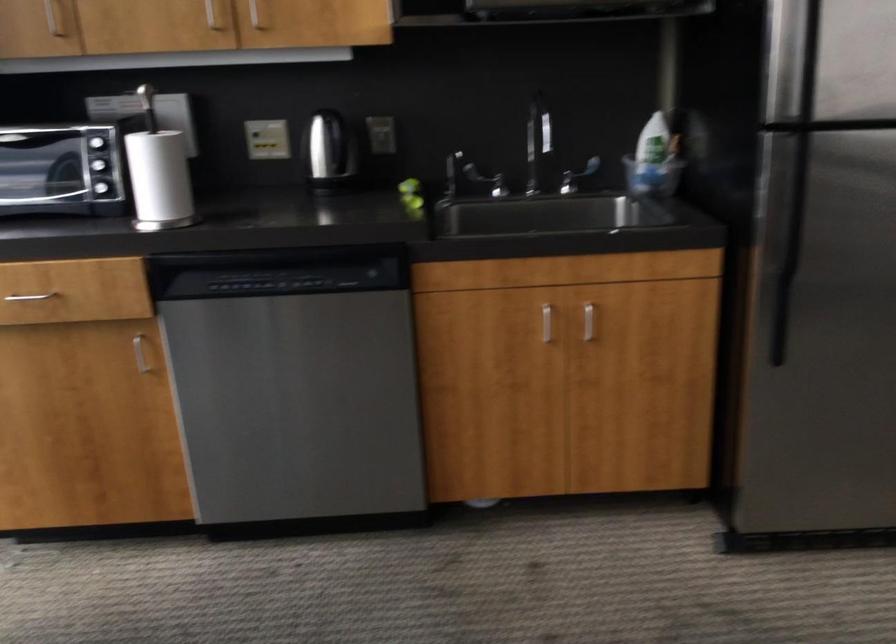
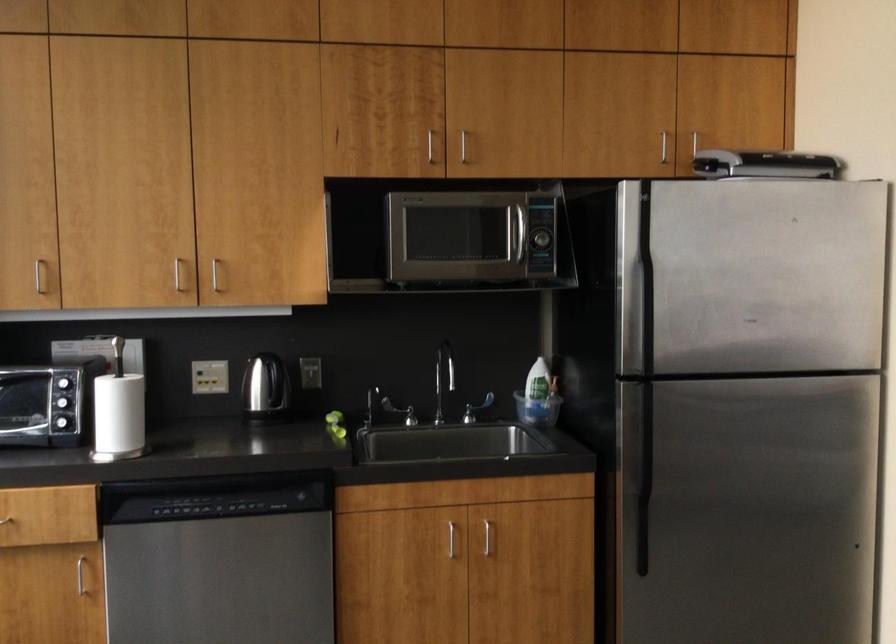
Find the pixel in the second image that matches point 785,254 in the first image.

(643, 480)